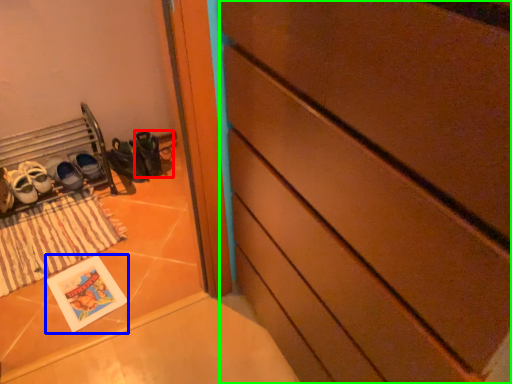
Question: Which object is the closest to the shoe (highlighted by a red box)? Choose among these: postcard (highlighted by a blue box) or chest of drawers (highlighted by a green box).

Choices:
 (A) postcard
 (B) chest of drawers

Answer: (A)